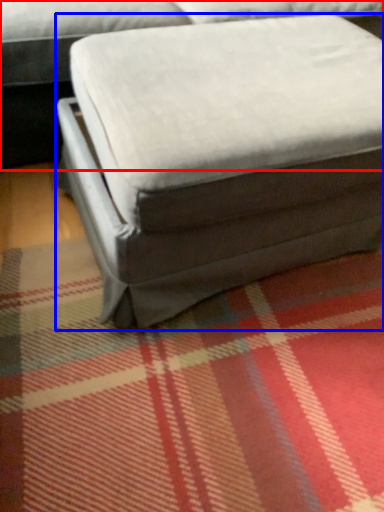
Question: Which of the following is the closest to the observer, studio couch (highlighted by a red box) or bean bag chair (highlighted by a blue box)?

Choices:
 (A) studio couch
 (B) bean bag chair

Answer: (B)